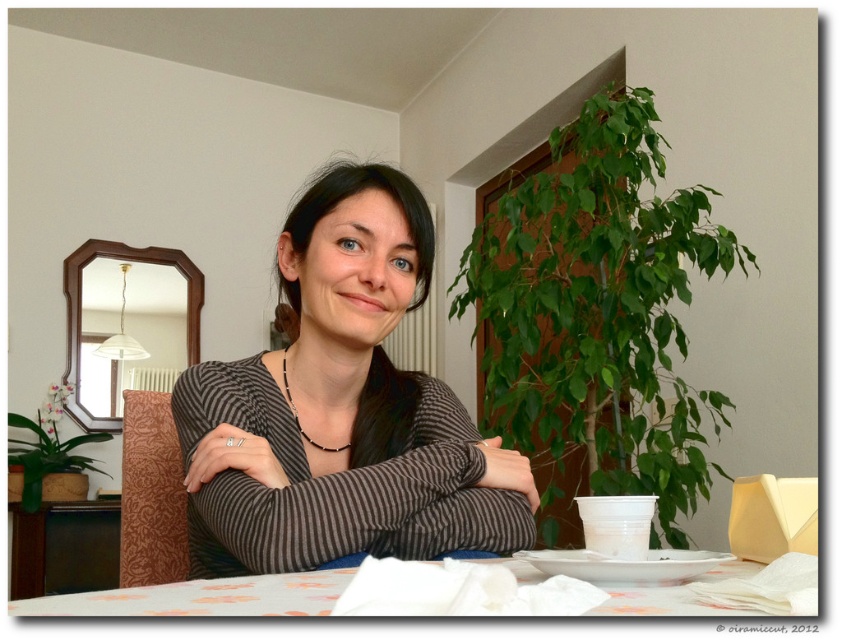
Question: Is brown striped sweater at center smaller than white glossy plate at lower center?

Choices:
 (A) yes
 (B) no

Answer: (B)

Question: Is brown striped sweater at center to the right of white fabric table at lower center from the viewer's perspective?

Choices:
 (A) no
 (B) yes

Answer: (A)

Question: Which object is the farthest from the white fabric table at lower center?

Choices:
 (A) brown striped sweater at center
 (B) white glossy plate at lower center

Answer: (A)

Question: Which object is closer to the camera taking this photo?

Choices:
 (A) white fabric table at lower center
 (B) white glossy plate at lower center

Answer: (A)

Question: Can you confirm if brown striped sweater at center is positioned below white fabric table at lower center?

Choices:
 (A) yes
 (B) no

Answer: (B)

Question: Which of the following is the closest to the observer?

Choices:
 (A) (744, 564)
 (B) (349, 221)

Answer: (A)